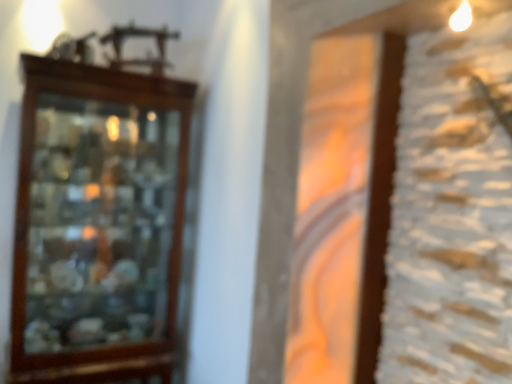
This screenshot has height=384, width=512. What do you see at coordinates (98, 223) in the screenshot? I see `brown wooden cabinet at left` at bounding box center [98, 223].

Measure the distance between point (95, 218) and camera.

Point (95, 218) and camera are 1.71 meters apart.

Locate an element on the screen. brown wooden cabinet at left is located at coordinates (98, 223).

Identify the location of brown wooden cabinet at left. The height and width of the screenshot is (384, 512). (98, 223).